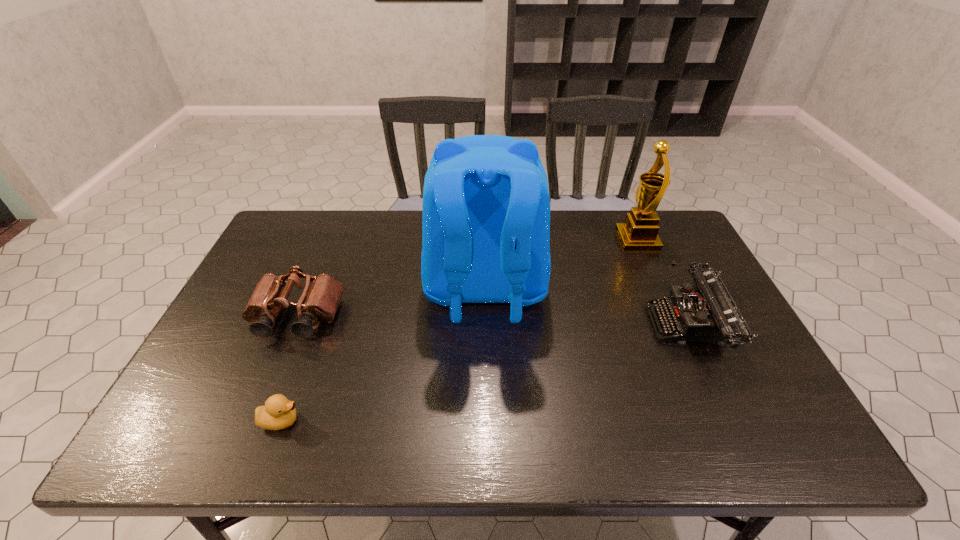
The height and width of the screenshot is (540, 960). What are the coordinates of `empty space between the fourth shortest object and the backpack` in the screenshot? It's located at (561, 265).

Where is `free spot between the typewriter and the backpack`? free spot between the typewriter and the backpack is located at coordinates (587, 307).

Where is `vacant area that lies between the binoculars and the nearest object`? The width and height of the screenshot is (960, 540). vacant area that lies between the binoculars and the nearest object is located at coordinates (289, 369).

At what (x,y) coordinates should I click in order to perform the action: click on vacant point located between the binoculars and the duckling. Please return your answer as a coordinate pair (x, y). This screenshot has width=960, height=540. Looking at the image, I should click on (289, 369).

What are the coordinates of `vacant area between the tallest object and the award` in the screenshot? It's located at (561, 265).

Locate an element on the screen. This screenshot has height=540, width=960. free point between the backpack and the shortest object is located at coordinates (383, 354).

Locate an element on the screen. The width and height of the screenshot is (960, 540). vacant space that is in between the backpack and the fourth shortest object is located at coordinates (561, 265).

Locate an element on the screen. empty space that is in between the tallest object and the nearest object is located at coordinates (383, 354).

Locate which object ranks fourth in proximity to the second tallest object. Please provide its 2D coordinates. Your answer should be formatted as a tuple, i.e. [(x, y)], where the tuple contains the x and y coordinates of a point satisfying the conditions above.

[(278, 413)]

Locate an element on the screen. The width and height of the screenshot is (960, 540). object that stands as the second closest to the duckling is located at coordinates (486, 210).